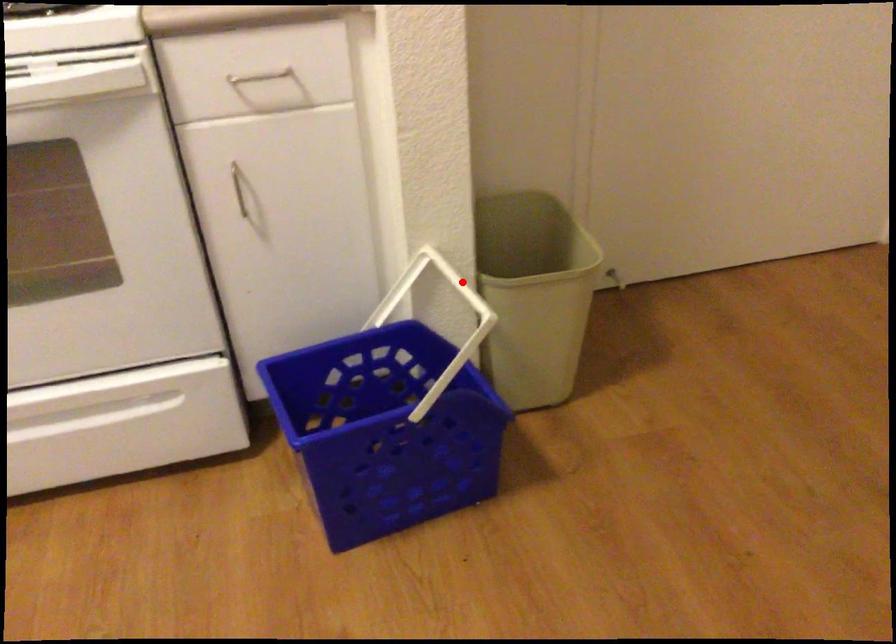
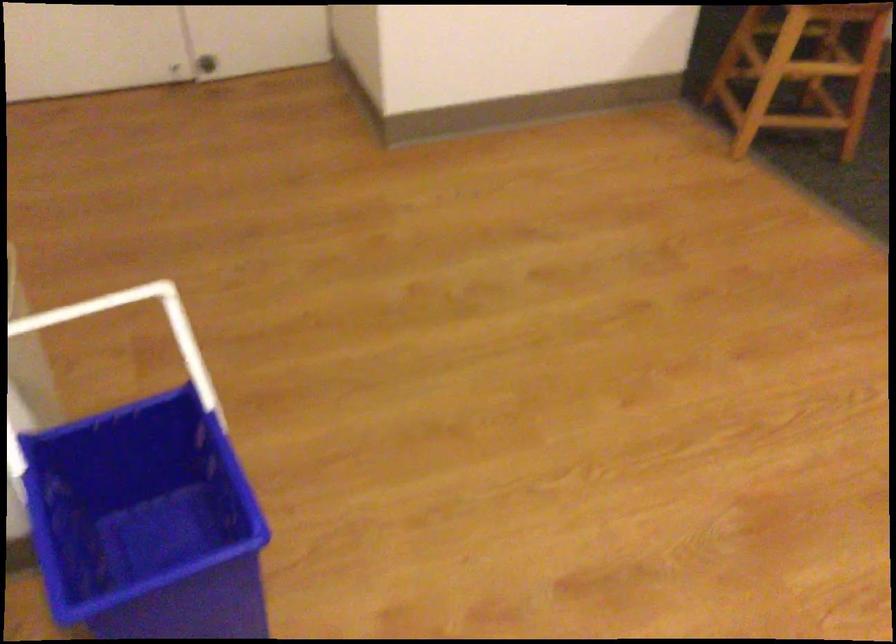
Question: A red point is marked in image1. In image2, is the corresponding 3D point closer to the camera or farther? Reply with the corresponding letter.

Choices:
 (A) The corresponding 3D point is closer.
 (B) The corresponding 3D point is farther.

Answer: (A)